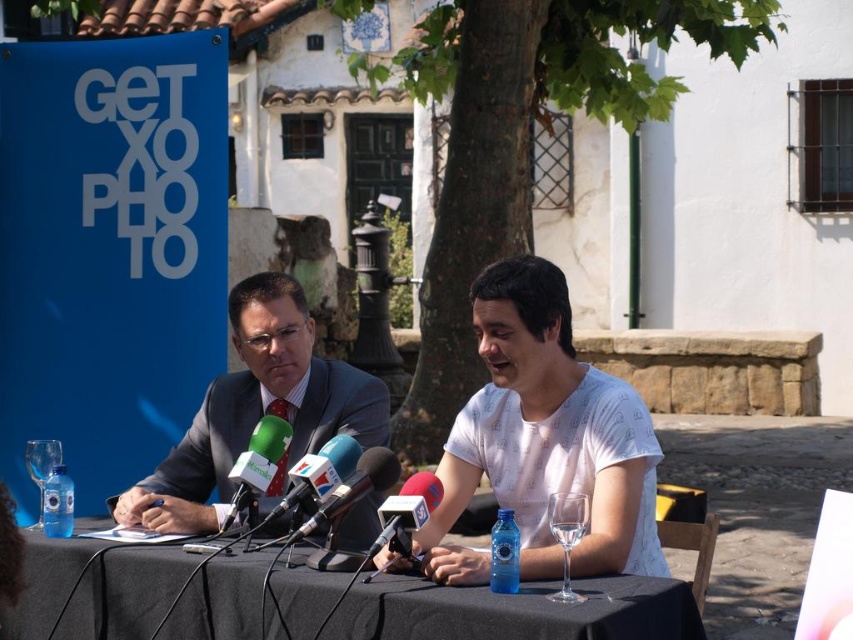
Question: Is black fabric table at center positioned behind green matte microphone at center?

Choices:
 (A) no
 (B) yes

Answer: (A)

Question: Is white printed shirt at center smaller than metallic microphones at center?

Choices:
 (A) no
 (B) yes

Answer: (A)

Question: Which point is farther to the camera?

Choices:
 (A) (589, 586)
 (B) (515, 298)

Answer: (B)

Question: Considering the relative positions of white printed shirt at center and metallic microphones at center in the image provided, where is white printed shirt at center located with respect to metallic microphones at center?

Choices:
 (A) above
 (B) below

Answer: (A)

Question: Which point is closer to the camera taking this photo?

Choices:
 (A) (328, 472)
 (B) (612, 384)
 (C) (271, 442)

Answer: (A)

Question: Which object is the farthest from the green plastic microphone at center?

Choices:
 (A) green matte microphone at center
 (B) black fabric table at center
 (C) matte black suit at center
 (D) metallic microphones at center

Answer: (C)